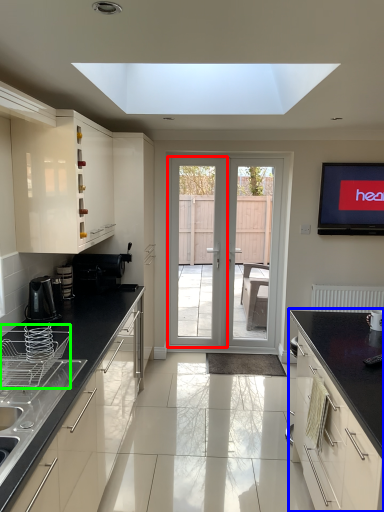
Question: Estimate the real-world distances between objects in this image. Which object is closer to screen door (highlighted by a red box), cabinetry (highlighted by a blue box) or appliance (highlighted by a green box)?

Choices:
 (A) cabinetry
 (B) appliance

Answer: (A)